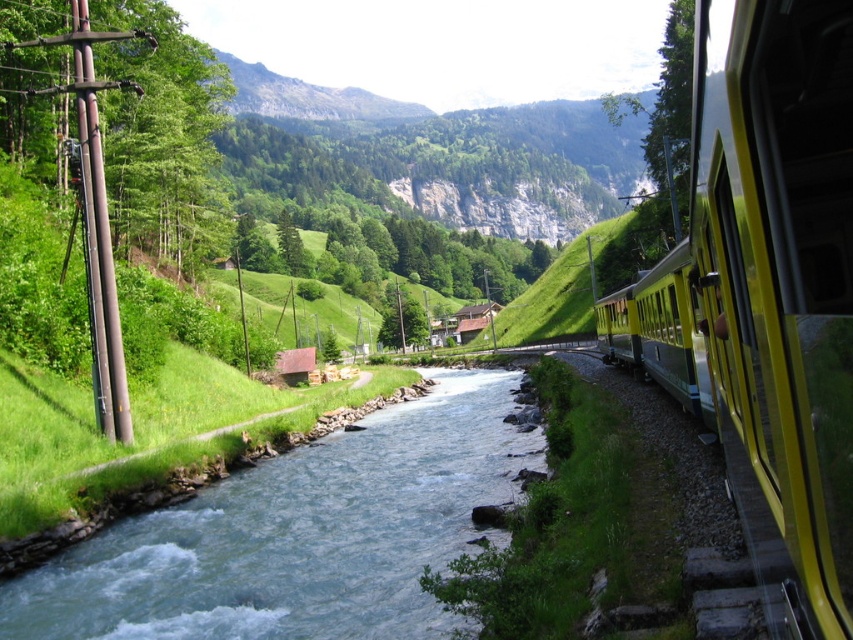
You are a photographer planning to capture the yellow polished metal train at right and the blue smooth water at center in a single shot. Considering their heights, which object should you position closer to the camera to ensure both are fully visible in the frame?

The yellow polished metal train at right is taller than the blue smooth water at center. To ensure both are fully visible, position the yellow polished metal train at right closer to the camera so its height doesn

You are a photographer planning to capture a wide shot of the yellow polished metal train at right and the blue smooth water at center. Based on their sizes, which object should you focus on to ensure both fit in the frame without cropping?

The yellow polished metal train at right is wider than the blue smooth water at center. To ensure both fit in the frame without cropping, focus on the wider object, the yellow polished metal train at right, and position it centrally while allowing space for the narrower blue smooth water at center.

You are a photographer planning to capture the yellow polished metal train at right and the blue smooth water at center in a single frame. Based on their positions, which object should you focus on first to ensure both are in the frame without moving the camera?

The yellow polished metal metal train at right is positioned on the right side of blue smooth water at center. To include both in the frame without moving the camera, focus on the blue smooth water at center first, as it is centrally located and the train is to its right.